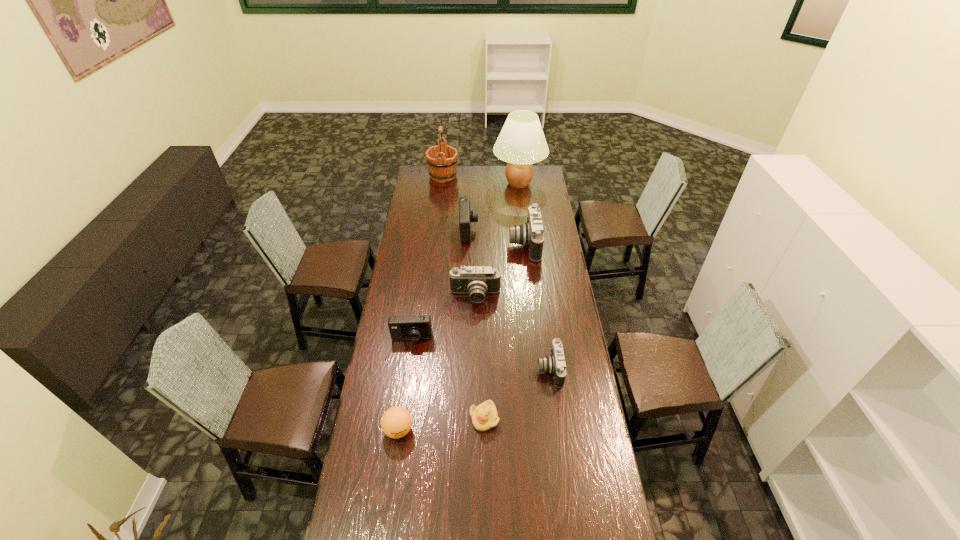
I want to click on empty location between the yellow duckling and the wine bucket, so click(x=464, y=297).

Where is `free space between the nearer blue camera and the third nearest object`? The image size is (960, 540). free space between the nearer blue camera and the third nearest object is located at coordinates (481, 354).

The height and width of the screenshot is (540, 960). I want to click on free space between the second smallest black camera and the wood wine bucket, so click(459, 236).

Locate an element on the screen. free area in between the shortest object and the bigger blue camera is located at coordinates (476, 325).

Identify the location of free space that is in between the ping-pong ball and the yellow duckling. The image size is (960, 540). (442, 424).

What are the coordinates of `vacant space that is in between the smallest black camera and the fifth nearest object` in the screenshot? It's located at (513, 333).

Where is `free spot between the lampshade and the leftmost camera`? The image size is (960, 540). free spot between the lampshade and the leftmost camera is located at coordinates (466, 261).

Where is `free space between the right blue camera and the tallest object`? The width and height of the screenshot is (960, 540). free space between the right blue camera and the tallest object is located at coordinates (493, 207).

The height and width of the screenshot is (540, 960). Identify the location of free space between the leftmost camera and the farther blue camera. (441, 285).

At what (x,y) coordinates should I click in order to perform the action: click on empty space between the ping-pong ball and the biggest black camera. Please return your answer as a coordinate pair (x, y). This screenshot has height=540, width=960. Looking at the image, I should click on (462, 337).